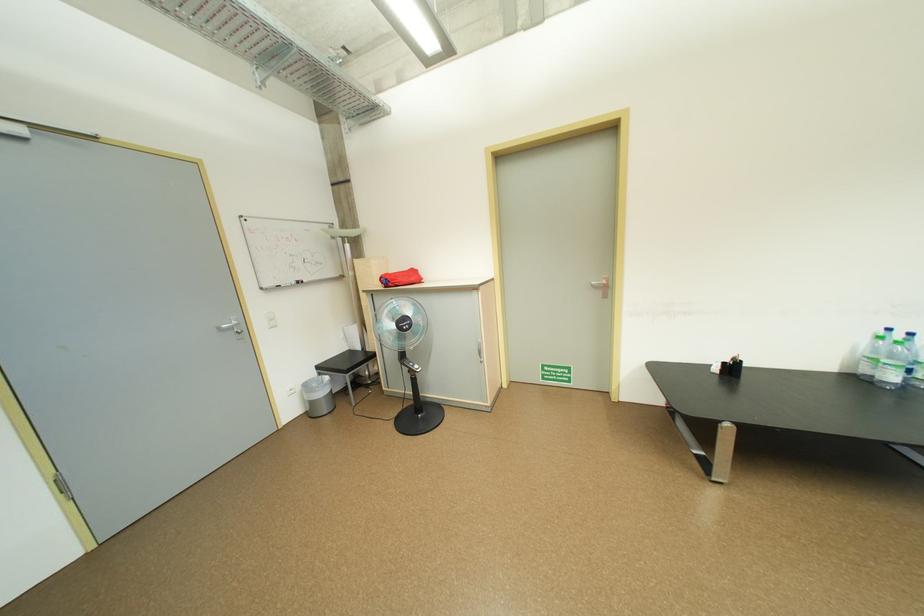
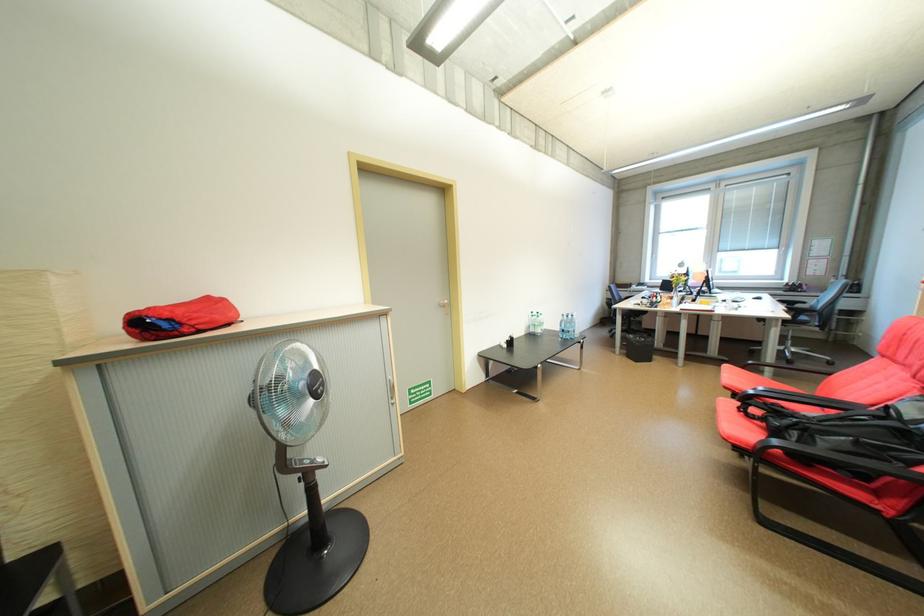
In the second image, find the point that corresponds to pixel 399 285 in the first image.

(196, 331)